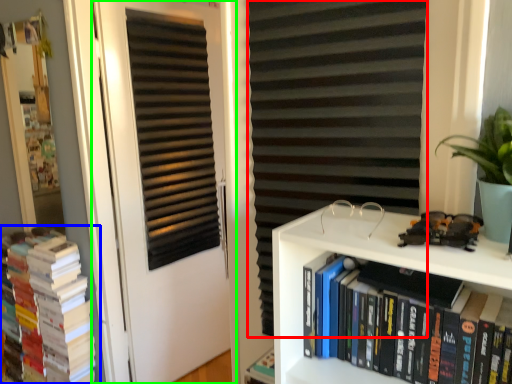
Question: Based on their relative distances, which object is farther from curtain (highlighted by a red box)? Choose from book (highlighted by a blue box) and door (highlighted by a green box).

Choices:
 (A) book
 (B) door

Answer: (A)